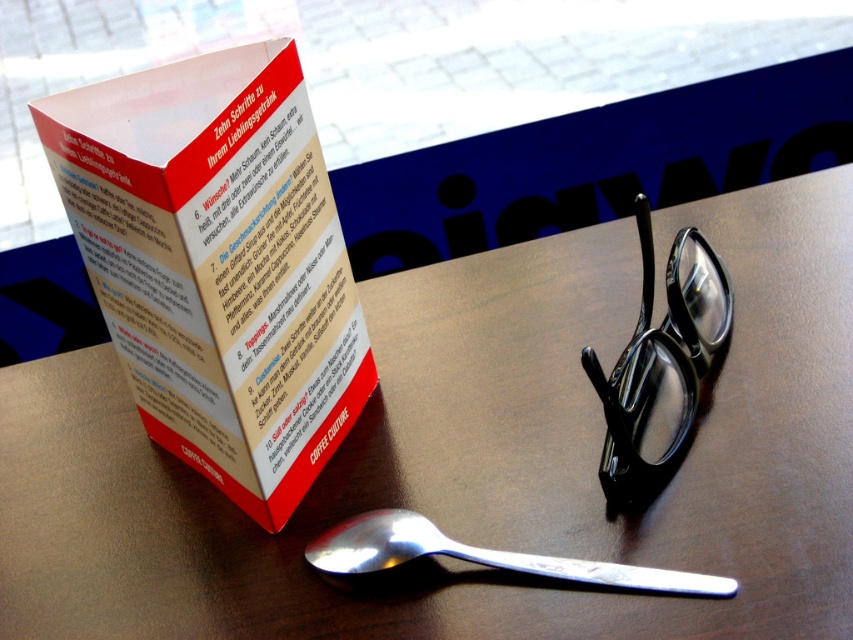
Between black shiny glasses at center and silver metallic spoon at lower center, which one appears on the left side from the viewer's perspective?

silver metallic spoon at lower center

Is black shiny glasses at center taller than silver metallic spoon at lower center?

Yes.

In order to click on black shiny glasses at center in this screenshot , I will do `click(660, 362)`.

Which is behind, point (244, 200) or point (434, 540)?

The point (434, 540) is more distant.

Can you confirm if red paper brochure at upper center is taller than silver metallic spoon at lower center?

Indeed, red paper brochure at upper center has a greater height compared to silver metallic spoon at lower center.

The width and height of the screenshot is (853, 640). In order to click on red paper brochure at upper center in this screenshot , I will do `click(218, 264)`.

Does point (844, 326) lie in front of point (343, 572)?

No, (844, 326) is further to viewer.

Does shiny brown table at center have a greater height compared to silver metallic spoon at lower center?

Yes.

Is point (705, 548) positioned behind point (335, 529)?

No, it is in front of (335, 529).

Identify the location of shiny brown table at center. This screenshot has height=640, width=853. coord(479,456).